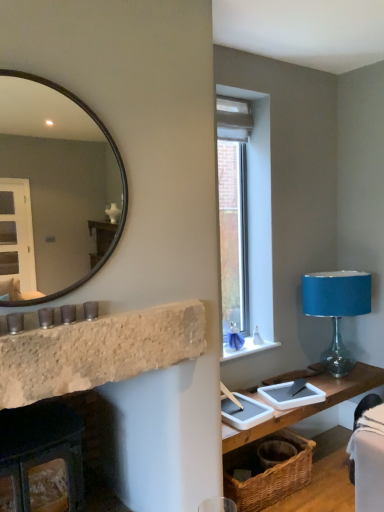
Question: Is white stone window sill at center wider or thinner than rustic stone fireplace at left, the second fireplace when ordered from bottom to top?

Choices:
 (A) wide
 (B) thin

Answer: (A)

Question: From the image's perspective, is white stone window sill at center above or below rustic stone fireplace at left, the second fireplace when ordered from bottom to top?

Choices:
 (A) above
 (B) below

Answer: (B)

Question: Which is farther from the rustic stone fireplace at left, which ranks as the first fireplace in top-to-bottom order?

Choices:
 (A) velvet black swivel chair at lower right
 (B) white stone window sill at center
 (C) rustic stone fireplace at left, acting as the first fireplace starting from the bottom
 (D) black glass mirror at upper left
 (E) blue fabric-covered lamp at right

Answer: (D)

Question: Which of these objects is positioned farthest from the rustic stone fireplace at left, the second fireplace when ordered from bottom to top?

Choices:
 (A) blue fabric-covered lamp at right
 (B) white stone window sill at center
 (C) clear glass window at upper right
 (D) velvet black swivel chair at lower right
 (E) black glass mirror at upper left

Answer: (E)